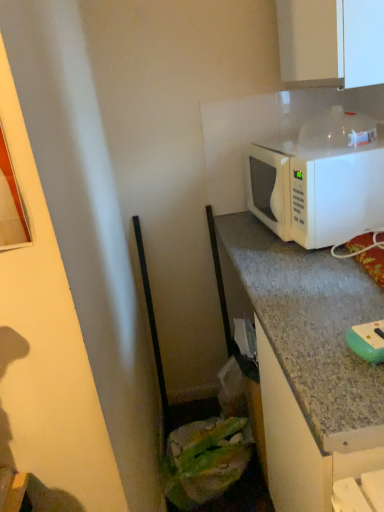
Question: Considering the relative positions of white matte microwave at upper right and white glossy cabinet at upper right in the image provided, is white matte microwave at upper right to the right of white glossy cabinet at upper right from the viewer's perspective?

Choices:
 (A) yes
 (B) no

Answer: (B)

Question: Considering the relative sizes of white matte microwave at upper right and white glossy cabinet at upper right in the image provided, is white matte microwave at upper right bigger than white glossy cabinet at upper right?

Choices:
 (A) yes
 (B) no

Answer: (A)

Question: Does white matte microwave at upper right have a lesser height compared to white glossy cabinet at upper right?

Choices:
 (A) no
 (B) yes

Answer: (B)

Question: Is white matte microwave at upper right aimed at white glossy cabinet at upper right?

Choices:
 (A) yes
 (B) no

Answer: (B)

Question: Is white matte microwave at upper right far away from white glossy cabinet at upper right?

Choices:
 (A) no
 (B) yes

Answer: (A)

Question: Is white glossy cabinet at upper right inside white matte microwave at upper right?

Choices:
 (A) yes
 (B) no

Answer: (B)

Question: Is white glossy cabinet at upper right surrounded by green rubber sponge at lower right?

Choices:
 (A) no
 (B) yes

Answer: (A)

Question: Is green rubber sponge at lower right positioned with its back to white glossy cabinet at upper right?

Choices:
 (A) yes
 (B) no

Answer: (B)

Question: Is green rubber sponge at lower right oriented towards white glossy cabinet at upper right?

Choices:
 (A) yes
 (B) no

Answer: (B)

Question: Is green rubber sponge at lower right at the right side of white glossy cabinet at upper right?

Choices:
 (A) yes
 (B) no

Answer: (A)

Question: Can you confirm if green rubber sponge at lower right is shorter than white glossy cabinet at upper right?

Choices:
 (A) yes
 (B) no

Answer: (A)

Question: Is green rubber sponge at lower right smaller than white glossy cabinet at upper right?

Choices:
 (A) no
 (B) yes

Answer: (B)

Question: Considering the relative sizes of white glossy cabinet at upper right and white matte microwave at upper right in the image provided, is white glossy cabinet at upper right smaller than white matte microwave at upper right?

Choices:
 (A) no
 (B) yes

Answer: (B)